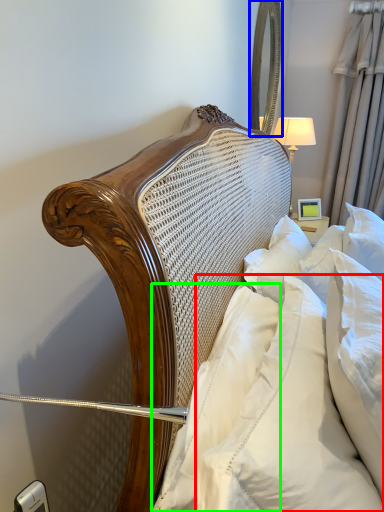
Question: Which object is the closest to the pillow (highlighted by a red box)? Choose among these: mirror (highlighted by a blue box) or pillow (highlighted by a green box).

Choices:
 (A) mirror
 (B) pillow

Answer: (B)